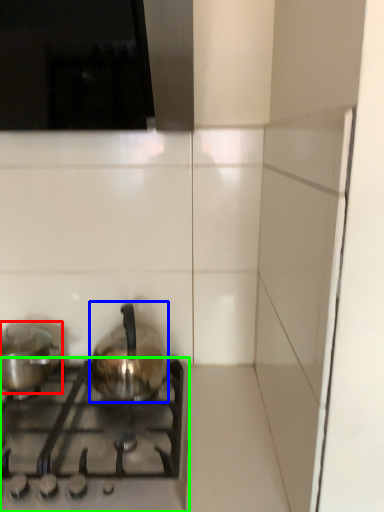
Question: Which is farther away from kitchen appliance (highlighted by a red box)? kitchen appliance (highlighted by a blue box) or gas stove (highlighted by a green box)?

Choices:
 (A) kitchen appliance
 (B) gas stove

Answer: (B)